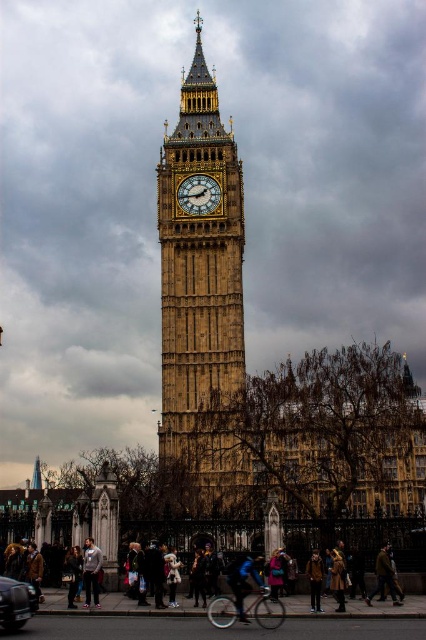
Question: Does shiny black car at lower left appear over blue fabric jacket at center?

Choices:
 (A) no
 (B) yes

Answer: (A)

Question: Based on their relative distances, which object is nearer to the dark blue jacket at lower center?

Choices:
 (A) gold textured clock at center
 (B) shiny black car at lower left
 (C) brown leather jacket at center
 (D) golden stone clock tower at center

Answer: (C)

Question: Does dark blue jacket at lower center have a smaller size compared to gray sweater at center?

Choices:
 (A) no
 (B) yes

Answer: (A)

Question: Which point is farther to the camera?

Choices:
 (A) (213, 198)
 (B) (245, 593)

Answer: (A)

Question: Does golden stone clock tower at center appear over gold textured clock at center?

Choices:
 (A) no
 (B) yes

Answer: (A)

Question: Estimate the real-world distances between objects in this image. Which object is closer to the golden stone clock tower at center?

Choices:
 (A) gold textured clock at center
 (B) blue fabric jacket at center
 (C) shiny black car at lower left

Answer: (A)